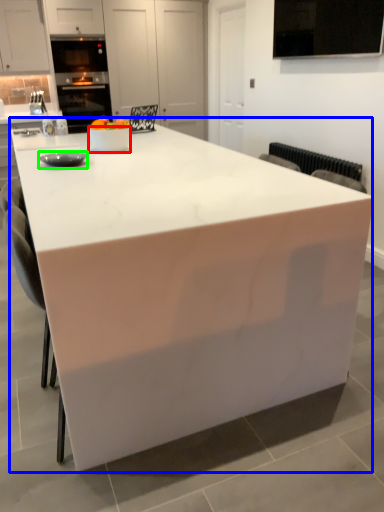
Question: Which is farther away from bowl (highlighted by a red box)? table (highlighted by a blue box) or appliance (highlighted by a green box)?

Choices:
 (A) table
 (B) appliance

Answer: (A)